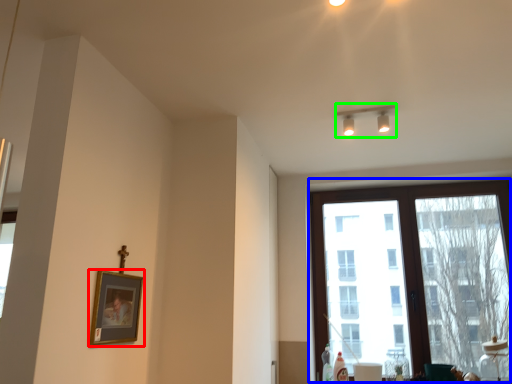
Question: Estimate the real-world distances between objects in this image. Which object is farther from picture frame (highlighted by a red box), window (highlighted by a blue box) or lamp (highlighted by a green box)?

Choices:
 (A) window
 (B) lamp

Answer: (A)